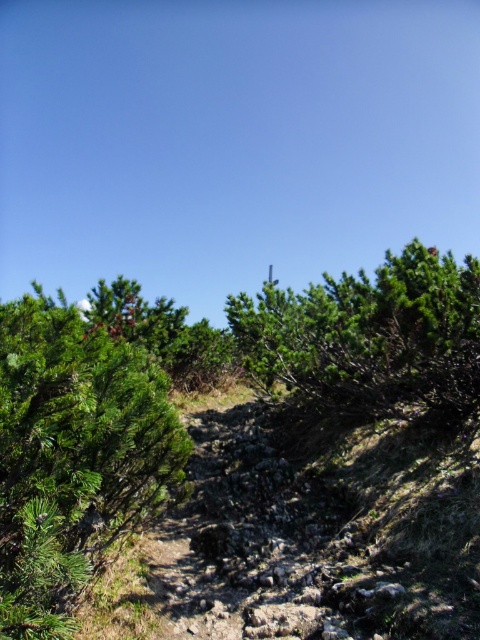
You are hiking on the narrow path and need to pass between the green matte bush at left and the green matte tree at upper center. Which one has a narrower width?

The green matte bush at left is thinner than the green matte tree at upper center, so the green matte bush at left has a narrower width.

Consider the image. You are a hiker navigating the rocky path. You see the green matte bush at left and the green matte tree at upper center. Which one is positioned higher up the slope?

The green matte tree at upper center is positioned higher up the slope than the green matte bush at left.

You are standing at the starting point of the path and want to reach the end of the path. Which point, point (103, 548) or point (469, 364), is closer to your current position?

Point (103, 548) is closer to your current position because it is in front of point (469, 364).